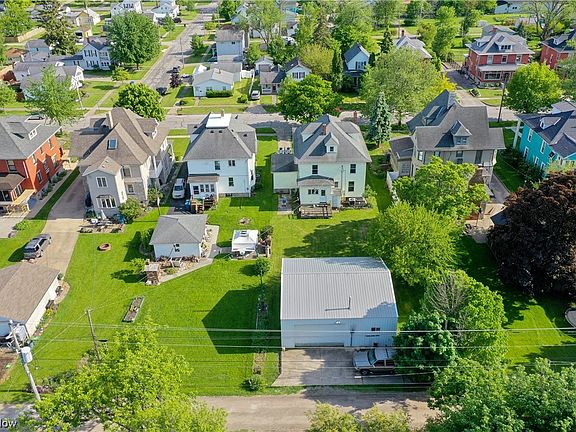
Where is `door`? This screenshot has width=576, height=432. door is located at coordinates [323, 195], [195, 192], [200, 92], [274, 87], [506, 75].